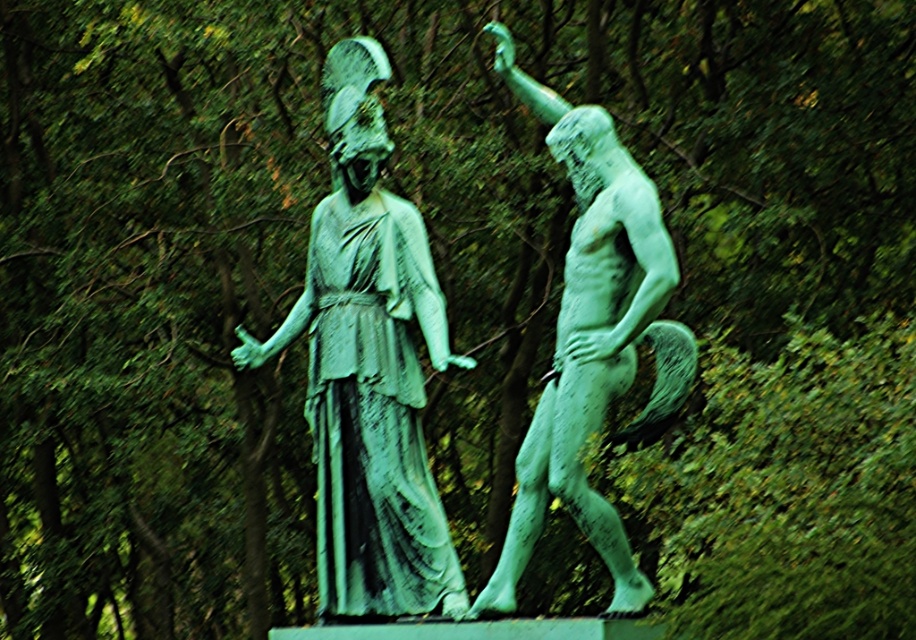
You are standing in a park and see the green patina statue at center. If you want to take a photo of it from a distance of exactly 80 meters, should you move closer or farther away?

The green patina statue at center is currently 78.27 meters away. To achieve an 80 meter distance, you need to move farther away from the statue.

Looking at this image, you are a sculptor who wants to transport both the green patina statue at center and the green patinated bronze at right using a truck with a 2.5 meter wide loading bay. Can both statues fit side by side in the truck bed without exceeding the width limit?

The green patina statue at center might be wider than green patinated bronze at right. Since the combined width of both statues could potentially exceed the 2.5 meter limit, it is uncertain if they can fit side by side without further measurements.